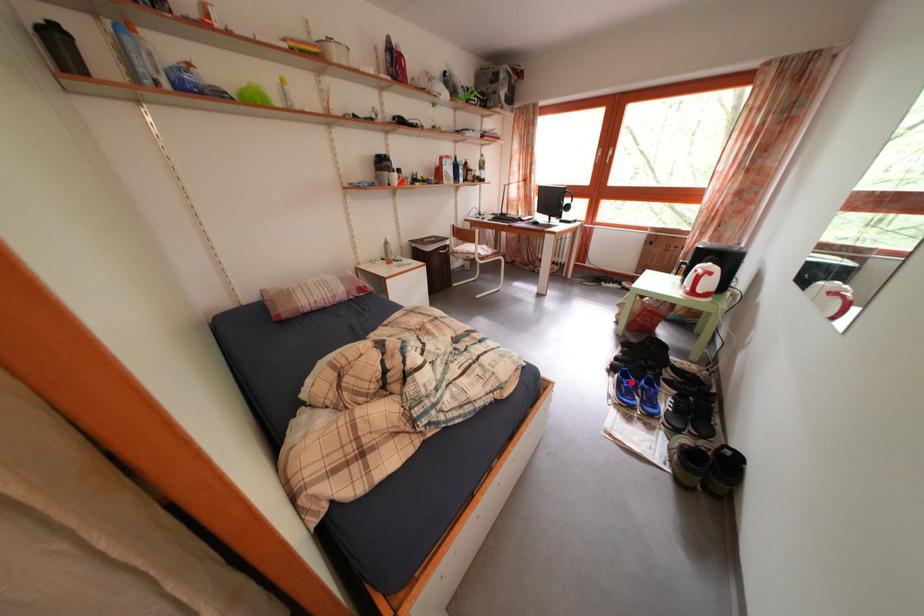
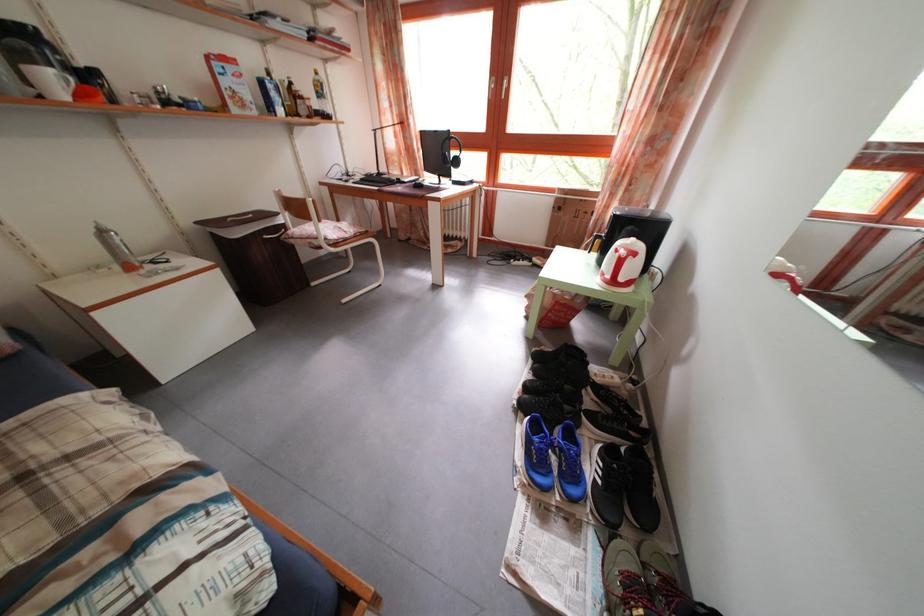
Where in the second image is the point corresponding to the highlighted location from the first image?

(542, 435)